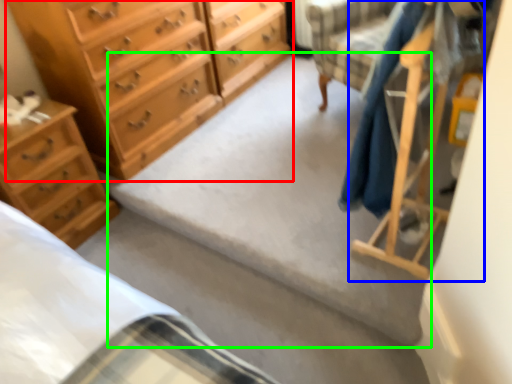
Question: Which is nearer to the chest of drawers (highlighted by a red box)? furniture (highlighted by a blue box) or concrete (highlighted by a green box).

Choices:
 (A) furniture
 (B) concrete

Answer: (B)